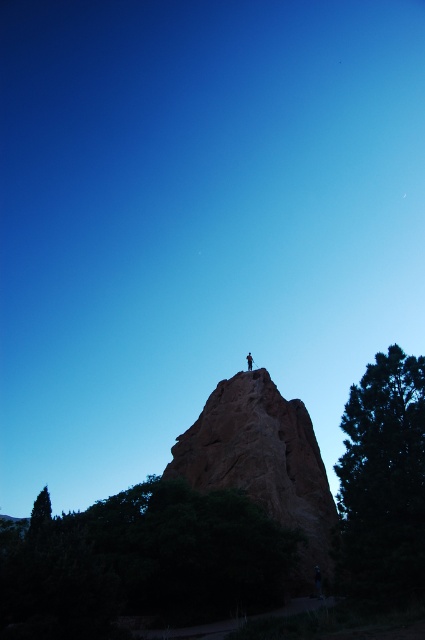
Question: Which point appears closest to the camera in this image?

Choices:
 (A) (268, 516)
 (B) (402, 461)

Answer: (B)

Question: From the image, what is the correct spatial relationship of green leafy tree at lower left in relation to rustic stone peak at center?

Choices:
 (A) right
 (B) left

Answer: (B)

Question: Is green textured tree at right wider than dark brown leather jacket at upper center?

Choices:
 (A) no
 (B) yes

Answer: (B)

Question: Is green leafy tree at lower left behind green textured tree at right?

Choices:
 (A) yes
 (B) no

Answer: (B)

Question: Which point appears farthest from the camera in this image?

Choices:
 (A) (238, 376)
 (B) (249, 525)
 (C) (251, 364)
 (D) (367, 541)

Answer: (C)

Question: Which is nearer to the green leafy tree at lower left?

Choices:
 (A) dark brown leather jacket at upper center
 (B) green textured tree at right

Answer: (B)